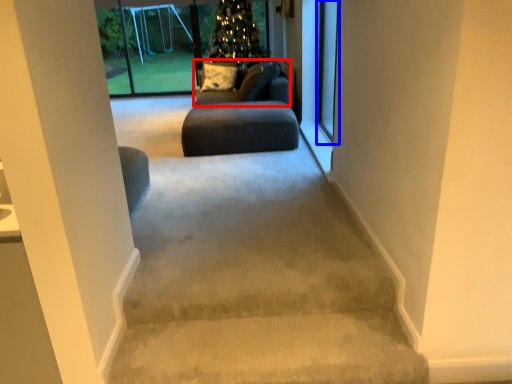
Question: Which object appears farthest to the camera in this image, couch (highlighted by a red box) or screen door (highlighted by a blue box)?

Choices:
 (A) couch
 (B) screen door

Answer: (A)